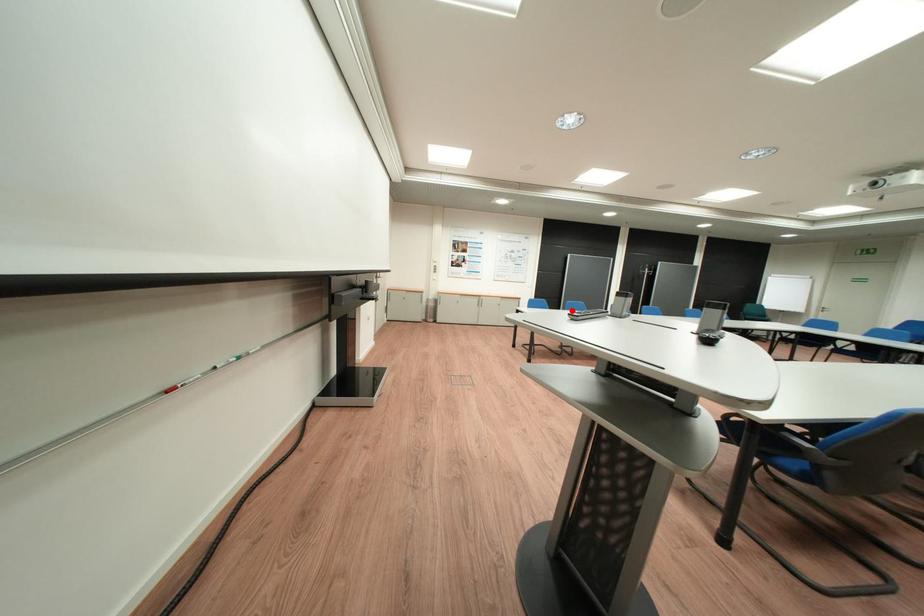
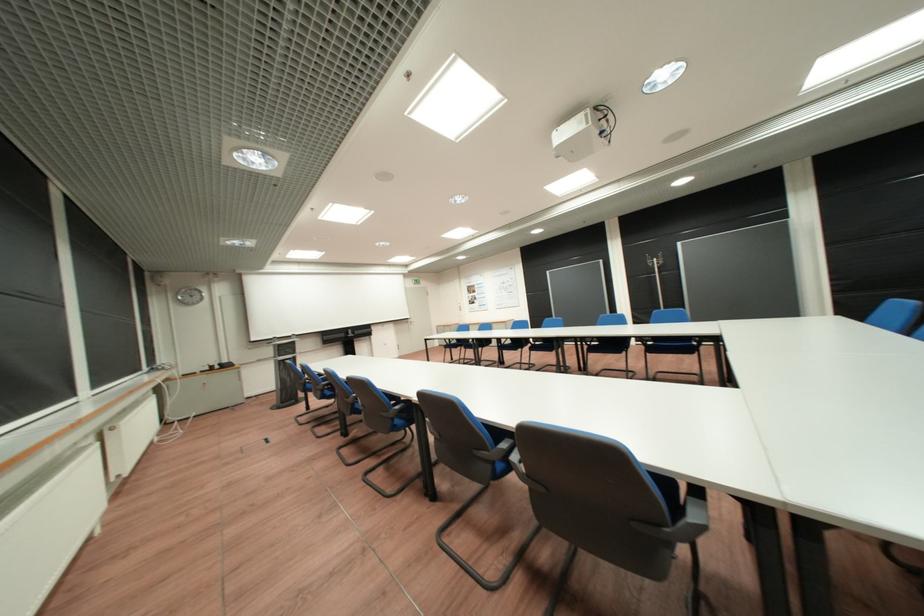
Question: I am providing you with two images of the same scene from different viewpoints. A red point is marked on the first image. At the location where the point appears in image 1, is it still visible in image 2?

Choices:
 (A) Yes
 (B) No

Answer: (B)